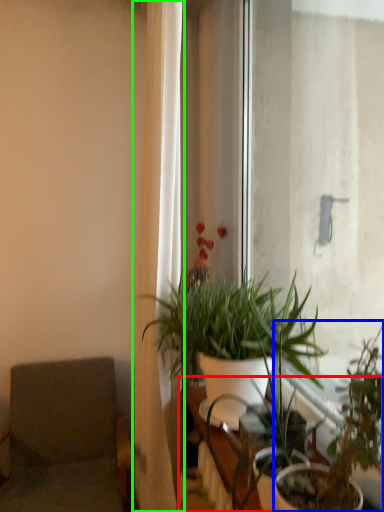
Question: Estimate the real-world distances between objects in this image. Which object is closer to table (highlighted by a red box), houseplant (highlighted by a blue box) or curtain (highlighted by a green box)?

Choices:
 (A) houseplant
 (B) curtain

Answer: (A)